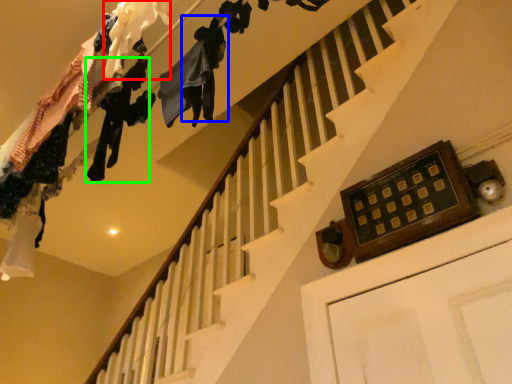
Question: Which object is the closest to the clothing (highlighted by a red box)? Choose among these: clothing (highlighted by a blue box) or clothing (highlighted by a green box).

Choices:
 (A) clothing
 (B) clothing

Answer: (A)